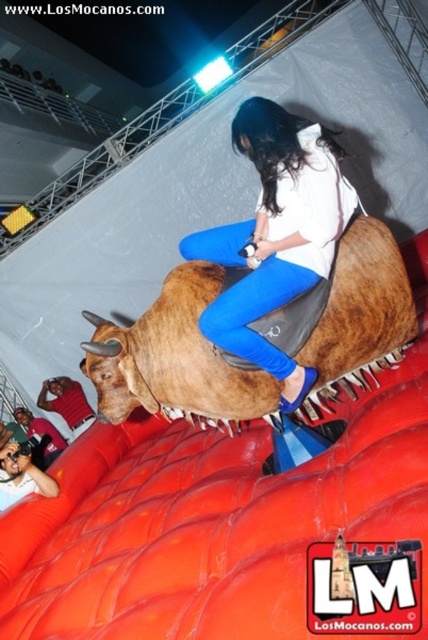
Question: Among these points, which one is farthest from the camera?

Choices:
 (A) (220, 332)
 (B) (73, 401)

Answer: (B)

Question: Observing the image, what is the correct spatial positioning of matte white shirt at center in reference to brushed metal shirt at lower left?

Choices:
 (A) right
 (B) left

Answer: (A)

Question: Which of these objects is positioned closest to the matte white shirt at center?

Choices:
 (A) smooth skin face at lower left
 (B) brown leather bull at center
 (C) brushed metal shirt at lower left

Answer: (B)

Question: Estimate the real-world distances between objects in this image. Which object is closer to the brown leather bull at center?

Choices:
 (A) brushed metal shirt at lower left
 (B) smooth skin face at lower left

Answer: (B)

Question: Is brown leather bull at center positioned before brushed metal shirt at lower left?

Choices:
 (A) no
 (B) yes

Answer: (B)

Question: Is smooth skin face at lower left below brushed metal shirt at lower left?

Choices:
 (A) yes
 (B) no

Answer: (A)